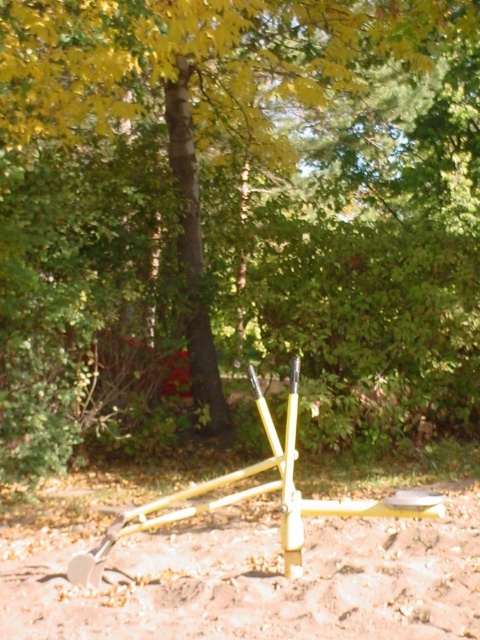
You are standing in the wooded area and want to walk from the yellow metal object to the dense greenery in the background. Which point, point (256, 628) or point (442, 506), should you aim for to reach the dense greenery first?

You should aim for point (442, 506) to reach the dense greenery first because point (256, 628) is in front of point (442, 506), meaning point (442, 506) is closer to the background where the dense greenery is located.

You are a hiker who has just found the green matte tree at center and the yellow metallic tool at center in a forest. You need to place a marker between them. Which object should you place the marker closer to so it is equidistant from both?

The marker should be placed exactly halfway between the green matte tree at center and the yellow metallic tool at center since they are positioned side by side with the tree on the left and the tool on the right.

You are a gardener who needs to reach both the yellow matte shovel at center and the yellow metallic tool at center from your current position. Which one is closer to you?

The yellow matte shovel at center and yellow metallic tool at center are 22.58 inches apart from each other, so without knowing your exact position, it is impossible to determine which one is closer. Please provide more information about your location relative to the tools.